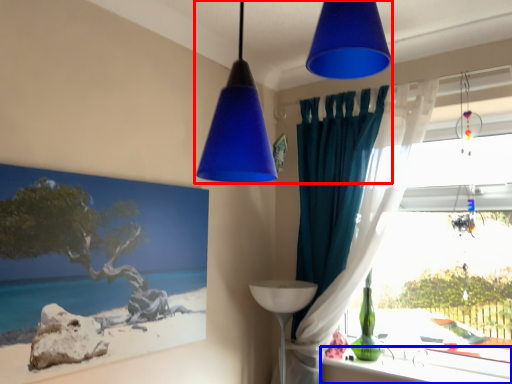
Question: Among these objects, which one is farthest to the camera, lamp (highlighted by a red box) or window sill (highlighted by a blue box)?

Choices:
 (A) lamp
 (B) window sill

Answer: (B)